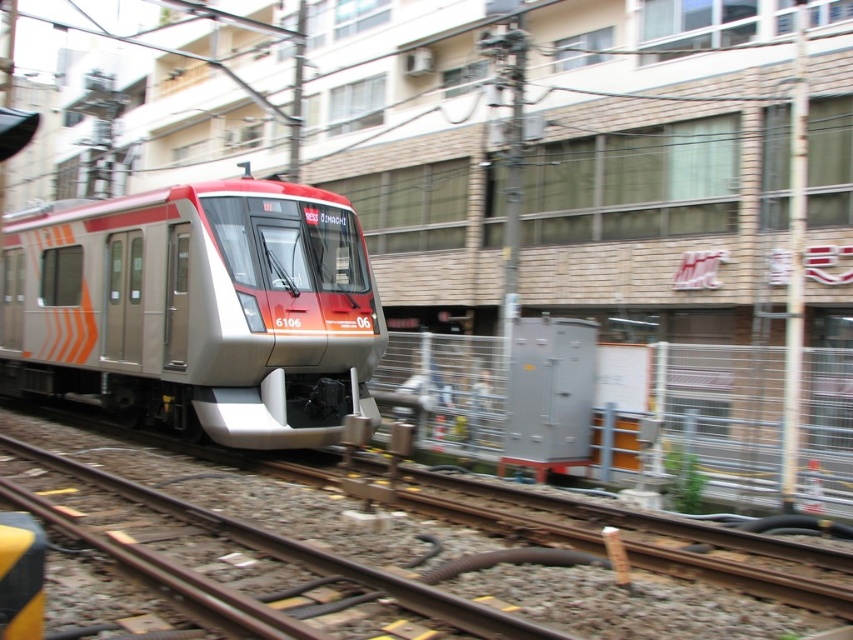
Can you confirm if metallic silver train at center is wider than metallic gray transformer at center-right?

No, metallic silver train at center is not wider than metallic gray transformer at center-right.

Who is taller, metallic silver train at center or metallic gray transformer at center-right?

metallic gray transformer at center-right is taller.

What do you see at coordinates (196, 308) in the screenshot?
I see `metallic silver train at center` at bounding box center [196, 308].

At what (x,y) coordinates should I click in order to perform the action: click on metallic silver train at center. Please return your answer as a coordinate pair (x, y). The image size is (853, 640). Looking at the image, I should click on (196, 308).